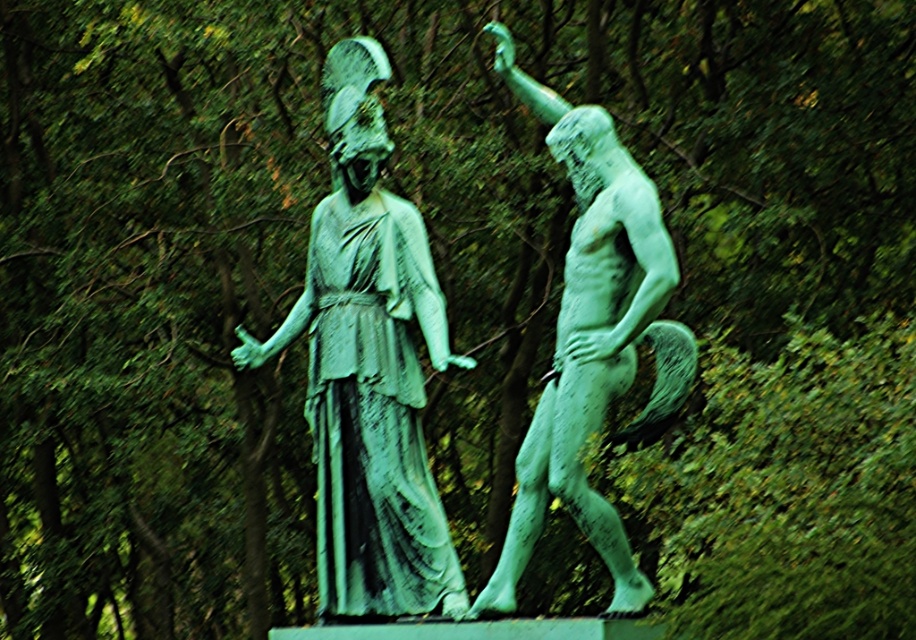
From the picture: Is green patina statue at center wider than green patinated bronze at right?

Yes, green patina statue at center is wider than green patinated bronze at right.

Who is shorter, green patina statue at center or green patinated bronze at right?

green patina statue at center is shorter.

Between point (351, 179) and point (591, 186), which one is positioned in front?

Point (591, 186) is more forward.

At what (x,y) coordinates should I click in order to perform the action: click on green patina statue at center. Please return your answer as a coordinate pair (x, y). Looking at the image, I should click on (368, 369).